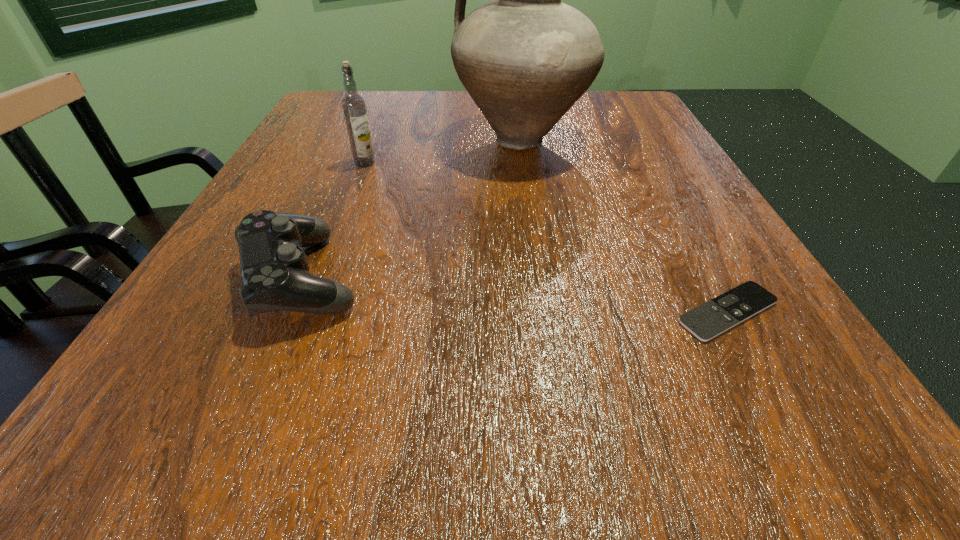
Identify the location of free space at the near left corner of the desktop. (222, 427).

I want to click on vacant space at the far right corner, so click(x=632, y=110).

Identify the location of vacant area that lies between the third shortest object and the control. The width and height of the screenshot is (960, 540). (333, 220).

Where is `vacant space that is in between the third shortest object and the remote control`? vacant space that is in between the third shortest object and the remote control is located at coordinates (546, 237).

The width and height of the screenshot is (960, 540). Find the location of `free space between the third shortest object and the second shortest object`. free space between the third shortest object and the second shortest object is located at coordinates (333, 220).

The width and height of the screenshot is (960, 540). Find the location of `unoccupied position between the control and the shortest object`. unoccupied position between the control and the shortest object is located at coordinates (515, 294).

This screenshot has height=540, width=960. I want to click on vacant space that is in between the remote control and the pitcher, so pyautogui.click(x=624, y=226).

Find the location of a particular element. free spot between the vodka and the shortest object is located at coordinates (546, 237).

Identify the location of vacant space in between the third shortest object and the third object from left to right. This screenshot has width=960, height=540. (443, 152).

I want to click on vacant area that lies between the vodka and the tallest object, so click(x=443, y=152).